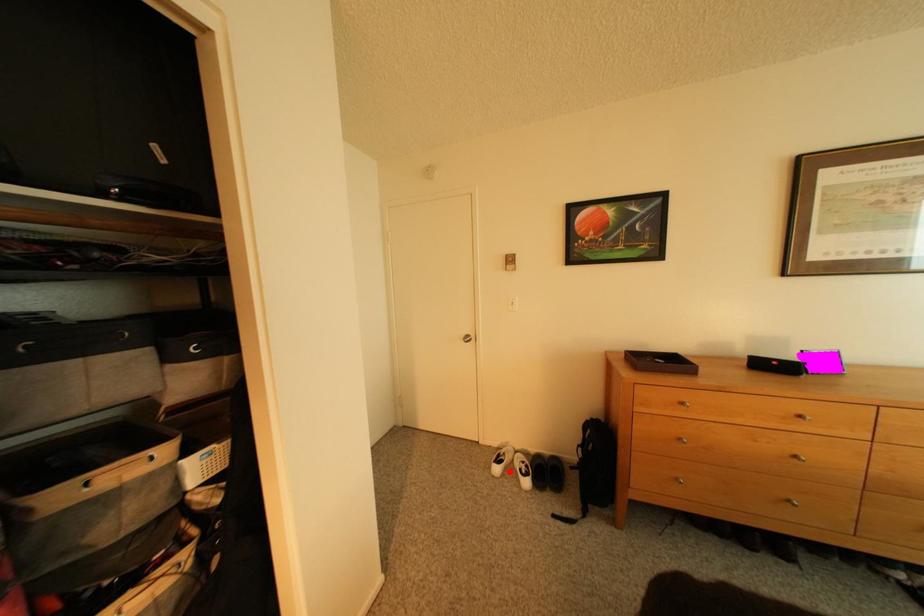
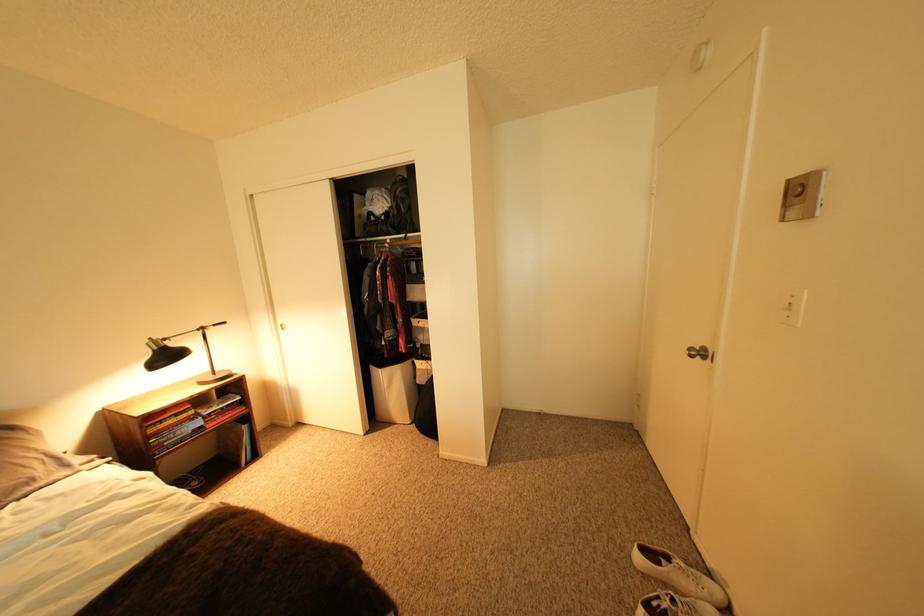
In the second image, find the point that corresponds to the highlighted location in the first image.

(651, 560)